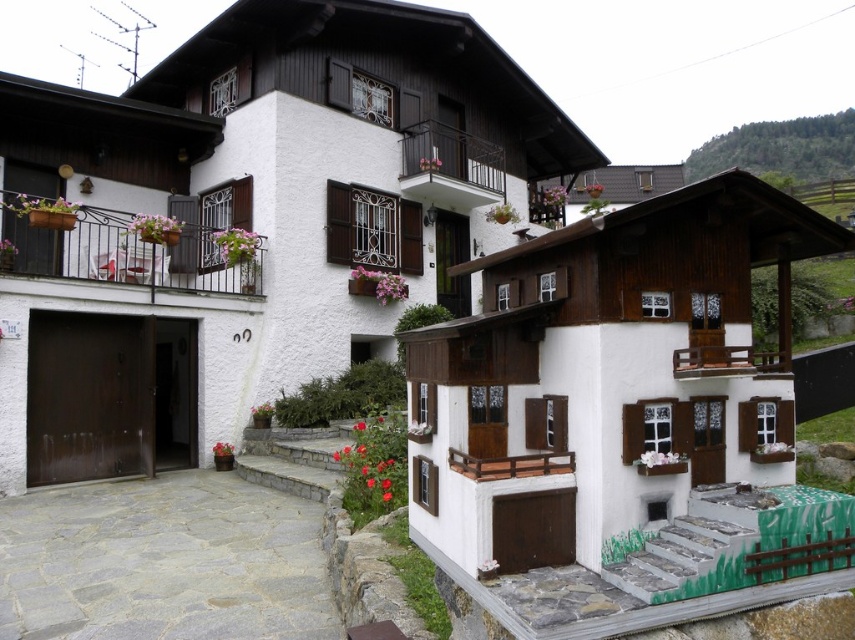
Between black metal balcony at upper center and wooden at center, which one is positioned lower?

wooden at center

What are the coordinates of `black metal balcony at upper center` in the screenshot? It's located at (450, 166).

In the scene shown: Who is positioned more to the right, green forested hillside at upper right or wooden at center?

green forested hillside at upper right

Which is above, green forested hillside at upper right or wooden at center?

green forested hillside at upper right is higher up.

Which is in front, point (848, 116) or point (556, 472)?

Point (556, 472)

Where is `green forested hillside at upper right`? This screenshot has width=855, height=640. green forested hillside at upper right is located at coordinates [780, 148].

Who is more forward, (817,156) or (342,228)?

Positioned in front is point (342,228).

Between green forested hillside at upper right and wooden balcony at center, which one has more height?

Standing taller between the two is green forested hillside at upper right.

What do you see at coordinates (780, 148) in the screenshot? I see `green forested hillside at upper right` at bounding box center [780, 148].

This screenshot has width=855, height=640. I want to click on green forested hillside at upper right, so coord(780,148).